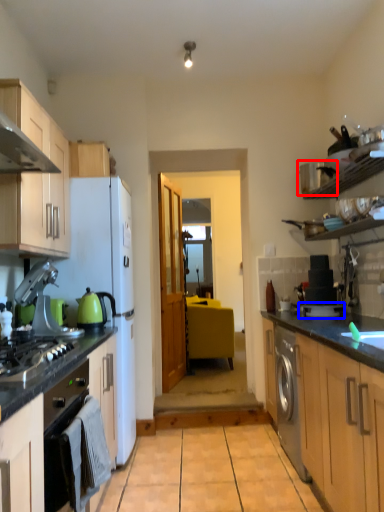
Question: Among these objects, which one is nearest to the camera, appliance (highlighted by a red box) or appliance (highlighted by a blue box)?

Choices:
 (A) appliance
 (B) appliance

Answer: (A)